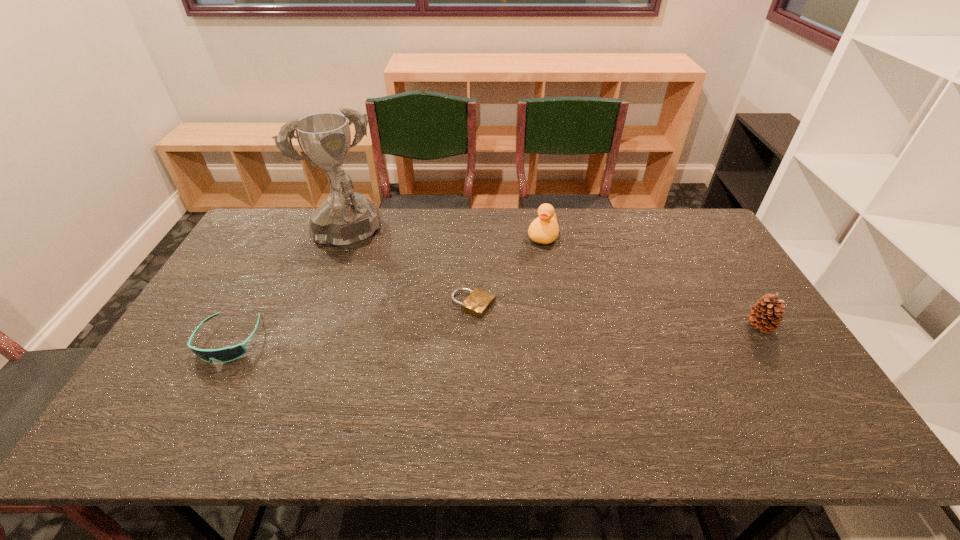
Find the location of `the leftmost object`. the leftmost object is located at coordinates (227, 354).

At what (x,y) coordinates should I click in order to perform the action: click on sunglasses. Please return your answer as a coordinate pair (x, y). Image resolution: width=960 pixels, height=540 pixels. Looking at the image, I should click on (227, 354).

I want to click on pinecone, so click(766, 315).

Find the location of a particular element. award is located at coordinates (346, 219).

Find the location of a particular element. The image size is (960, 540). the tallest object is located at coordinates (346, 219).

You are a GUI agent. You are given a task and a screenshot of the screen. Output one action in this format:
    pyautogui.click(x=<x>, y=<y>)
    Task: Click on the padlock
    The height and width of the screenshot is (540, 960).
    Given the screenshot: What is the action you would take?
    pyautogui.click(x=478, y=302)

This screenshot has width=960, height=540. Find the location of `the third object from right to left`. the third object from right to left is located at coordinates (478, 302).

I want to click on duck, so click(x=544, y=229).

Locate an element on the screen. The height and width of the screenshot is (540, 960). vacant space located 0.100m on the front-facing side of the leftmost object is located at coordinates [197, 401].

This screenshot has height=540, width=960. I want to click on vacant space located 0.160m on the back of the pinecone, so click(x=731, y=278).